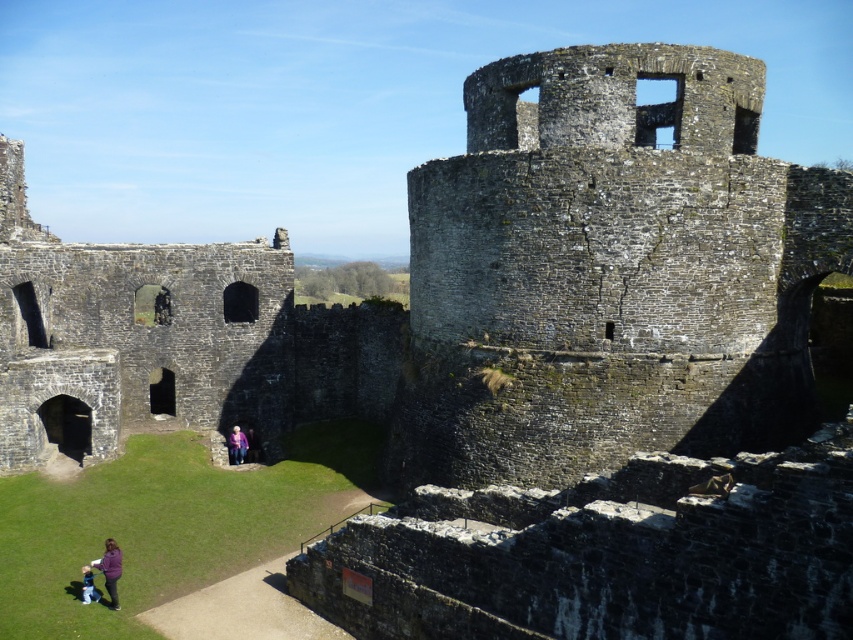
You are an archaeologist examining the medieval castle ruins. You notice a rusty stone tower at center and a purple woolen sweater at center. Which object is positioned to the right of the other?

The rusty stone tower at center is to the right of the purple woolen sweater at center.

In the scene shown: You are standing in front of the medieval castle ruins and see the purple fleece jacket at lower left. If you move 0.2 units to the right and 0.1 units up from your current position, will you be closer to the jacket?

Since the purple fleece jacket at lower left is located at point (109, 570), moving 0.2 units to the right and 0.1 units up would take you to position (195, 639). The jacket is at (109, 570), so moving right and up increases your distance from it. Therefore, you would be farther away from the jacket.

You are a hiker who has just arrived at the medieval castle ruins. You notice two items at the lower left corner of the scene. Which item is taller between the purple fleece jacket at lower left and the pink fabric at lower left?

The purple fleece jacket at lower left is taller than the pink fabric at lower left.